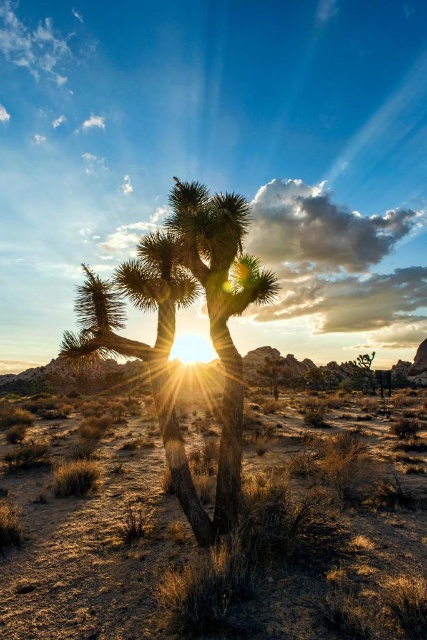
Question: Is brown textured desert at center in front of smooth brown palm tree at center?

Choices:
 (A) no
 (B) yes

Answer: (B)

Question: Is brown textured desert at center to the right of smooth brown palm tree at center from the viewer's perspective?

Choices:
 (A) yes
 (B) no

Answer: (B)

Question: Which point is farther to the camera?

Choices:
 (A) (230, 392)
 (B) (321, 593)

Answer: (A)

Question: Which point is farther to the camera?

Choices:
 (A) brown textured desert at center
 (B) smooth brown palm tree at center

Answer: (B)

Question: Observing the image, what is the correct spatial positioning of brown textured desert at center in reference to smooth brown palm tree at center?

Choices:
 (A) below
 (B) above

Answer: (A)